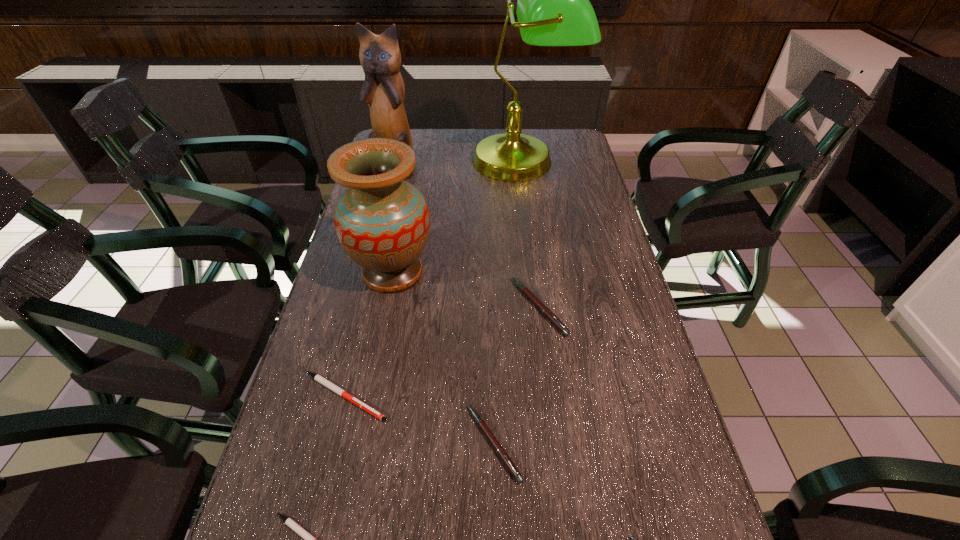
Locate an element on the screen. The image size is (960, 540). cat that is at the far edge is located at coordinates (383, 91).

Where is `cat located at the left edge`? cat located at the left edge is located at coordinates (383, 91).

Where is `vase at the left edge`? vase at the left edge is located at coordinates (382, 222).

What are the coordinates of `pen that is at the left edge` in the screenshot? It's located at (317, 377).

Identify the location of object that is at the right edge. (553, 9).

Where is `object at the far left corner`? object at the far left corner is located at coordinates (383, 91).

The height and width of the screenshot is (540, 960). Identify the location of object that is at the far right corner. (553, 9).

The image size is (960, 540). In the image, there is a desktop. In order to click on free space at the far edge in this screenshot , I will do `click(438, 145)`.

Locate an element on the screen. The width and height of the screenshot is (960, 540). free spot at the left edge of the desktop is located at coordinates (359, 399).

This screenshot has height=540, width=960. In the image, there is a desktop. Find the location of `vacant area at the right edge`. vacant area at the right edge is located at coordinates (658, 514).